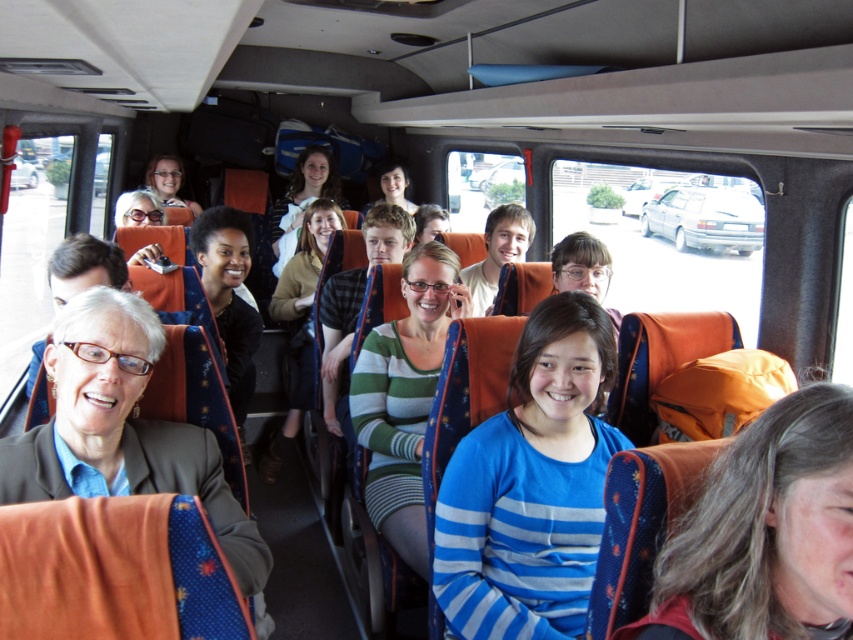
You are a photographer trying to capture a passenger with light brown hair at center and matte black glasses at center. Can you see both features clearly in the photo?

The light brown hair at center is positioned under matte black glasses at center, so the glasses may block the view of the hair, making it difficult to see both clearly in the photo.